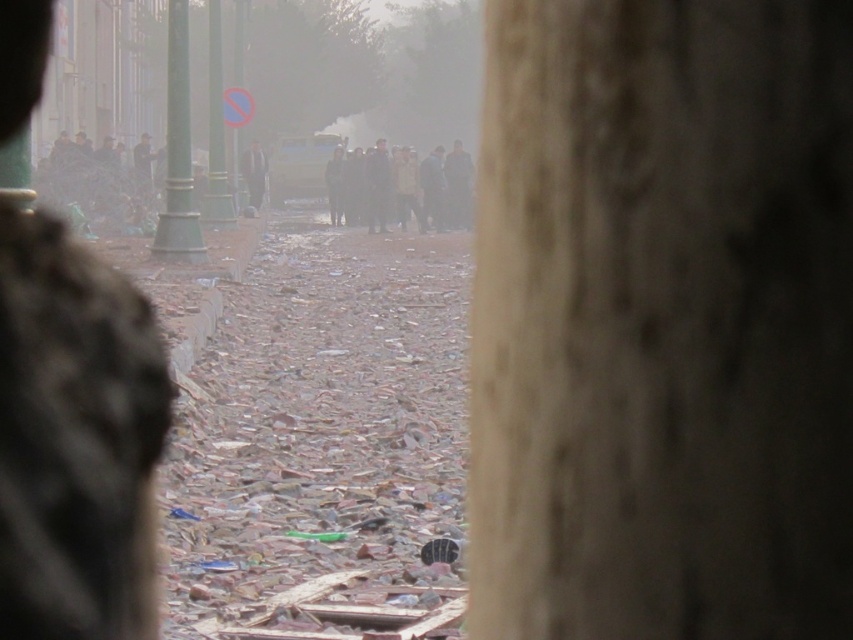
In the scene shown: You are standing on the street and see the smooth concrete pillar at center and the dark gray clothing at center. Which object is closer to the ground?

The smooth concrete pillar at center is located below dark gray clothing at center, so it is closer to the ground.

You are a pedestrian walking on the street and notice both the broken glass shards at center and the dark gray clothing at center. Which object is positioned lower in the image?

The broken glass shards at center is below dark gray clothing at center, so the broken glass shards at center is positioned lower in the image.